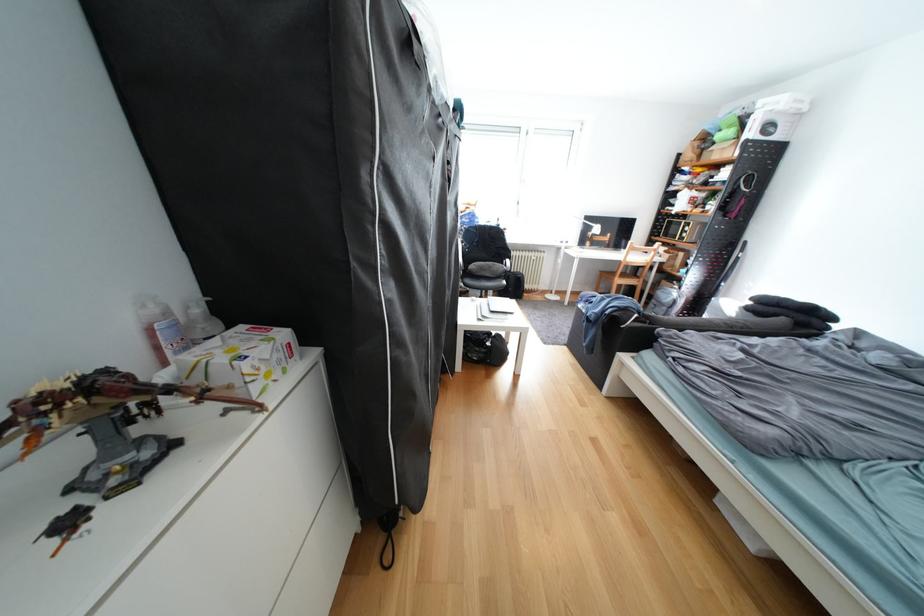
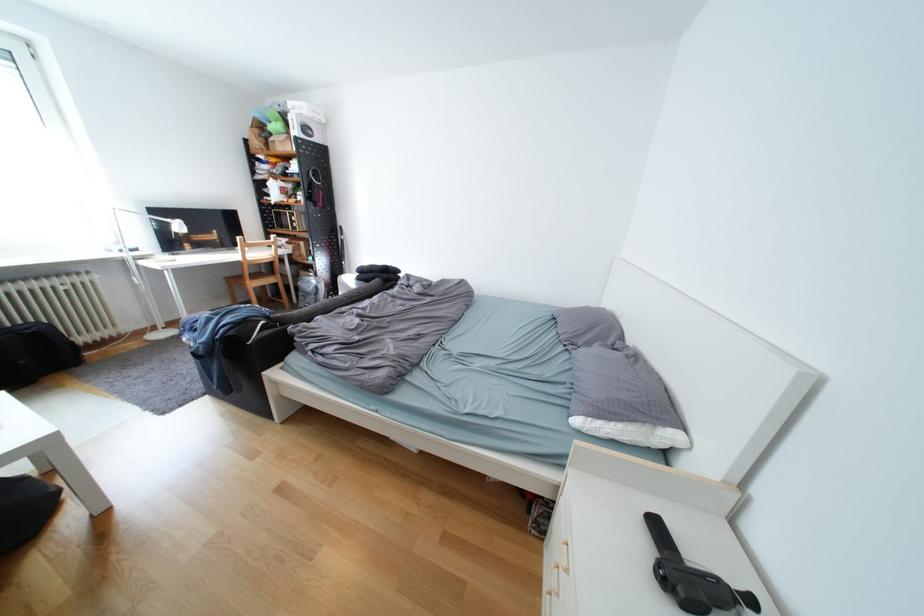
The point at (631, 282) is marked in the first image. Where is the corresponding point in the second image?

(265, 285)